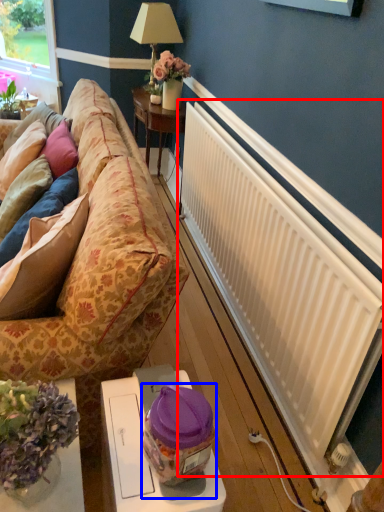
Question: Among these objects, which one is farthest to the camera, radiator (highlighted by a red box) or food (highlighted by a blue box)?

Choices:
 (A) radiator
 (B) food

Answer: (A)